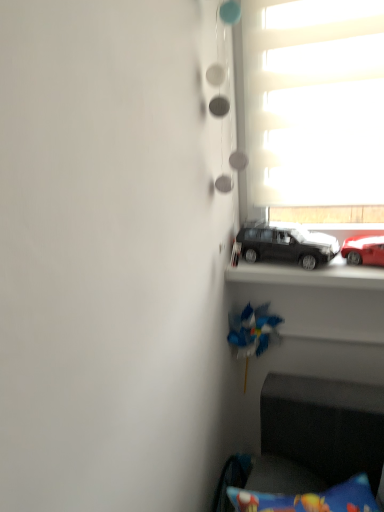
Question: Considering the relative sizes of blue plastic toy at center and shiny red car at right, the 1th car positioned from the right, in the image provided, is blue plastic toy at center smaller than shiny red car at right, the 1th car positioned from the right,?

Choices:
 (A) yes
 (B) no

Answer: (B)

Question: From a real-world perspective, is blue plastic toy at center beneath shiny red car at right, the 1th car positioned from the right?

Choices:
 (A) yes
 (B) no

Answer: (A)

Question: Does blue plastic toy at center lie behind shiny red car at right, which is the second car in left-to-right order?

Choices:
 (A) no
 (B) yes

Answer: (B)

Question: Is blue plastic toy at center to the right of shiny red car at right, which is the second car in left-to-right order, from the viewer's perspective?

Choices:
 (A) yes
 (B) no

Answer: (B)

Question: Considering the relative sizes of blue plastic toy at center and shiny red car at right, which is the second car in left-to-right order, in the image provided, is blue plastic toy at center taller than shiny red car at right, which is the second car in left-to-right order,?

Choices:
 (A) yes
 (B) no

Answer: (A)

Question: From the image's perspective, is blue plastic toy at center on top of shiny red car at right, the 1th car positioned from the right?

Choices:
 (A) yes
 (B) no

Answer: (B)

Question: Is white matte window at upper right facing away from shiny red car at right, the 1th car positioned from the right?

Choices:
 (A) yes
 (B) no

Answer: (B)

Question: Does white matte window at upper right have a greater width compared to shiny red car at right, the 1th car positioned from the right?

Choices:
 (A) no
 (B) yes

Answer: (A)

Question: Is white matte window at upper right oriented towards shiny red car at right, which is the second car in left-to-right order?

Choices:
 (A) yes
 (B) no

Answer: (B)

Question: Does white matte window at upper right have a lesser height compared to shiny red car at right, which is the second car in left-to-right order?

Choices:
 (A) no
 (B) yes

Answer: (A)

Question: Considering the relative positions of white matte window at upper right and shiny red car at right, the 1th car positioned from the right, in the image provided, is white matte window at upper right to the right of shiny red car at right, the 1th car positioned from the right, from the viewer's perspective?

Choices:
 (A) no
 (B) yes

Answer: (A)

Question: Considering the relative sizes of white matte window at upper right and shiny red car at right, which is the second car in left-to-right order, in the image provided, is white matte window at upper right smaller than shiny red car at right, which is the second car in left-to-right order,?

Choices:
 (A) yes
 (B) no

Answer: (B)

Question: Is shiny red car at right, which is the second car in left-to-right order, thinner than white matte window at upper right?

Choices:
 (A) yes
 (B) no

Answer: (B)